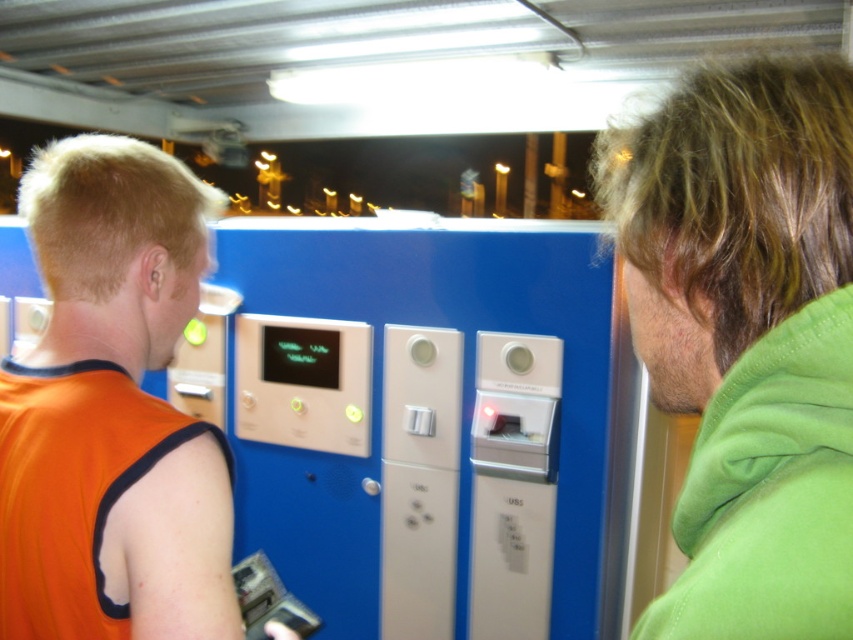
You are standing in front of the blue vending machine and want to hand a card to the person wearing the orange fabric sleeveless shirt at left. Which direction should you move to ensure the green fleece jacket at right doesn t block your view?

Since the green fleece jacket at right is closer to the viewer than orange fabric sleeveless shirt at left, you should move to the left side so that the orange fabric sleeveless shirt at left becomes visible behind the green fleece jacket at right.

You are standing in front of the blue vending machine at night. You see two points marked on the machine. The first point is at coordinates point (821, 609) and the second point is at point (126, 269). Which point is closer to you?

Point (821, 609) is in front of point (126, 269), so it is closer to you.